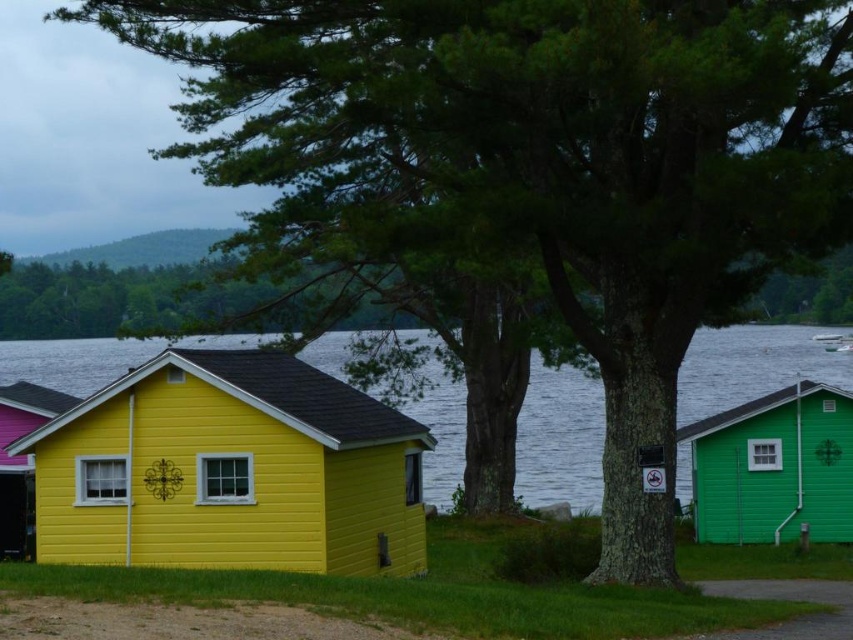
Does transparent water at lower center appear on the left side of yellow wood cabin at lower left?

In fact, transparent water at lower center is to the right of yellow wood cabin at lower left.

Is transparent water at lower center to the right of yellow wood cabin at lower left from the viewer's perspective?

Yes, transparent water at lower center is to the right of yellow wood cabin at lower left.

The image size is (853, 640). I want to click on transparent water at lower center, so click(x=560, y=438).

Between point (848, 419) and point (30, 461), which one is positioned in front?

Positioned in front is point (30, 461).

Can you confirm if green matte wood cabin at right is shorter than yellow wood cabin at lower left?

Incorrect, green matte wood cabin at right's height does not fall short of yellow wood cabin at lower left's.

Which is behind, point (780, 481) or point (62, 410)?

The point (780, 481) is behind.

Locate an element on the screen. green matte wood cabin at right is located at coordinates pos(775,467).

Is yellow wood cabin at center wider than yellow wood cabin at lower left?

Correct, the width of yellow wood cabin at center exceeds that of yellow wood cabin at lower left.

Is point (421, 440) more distant than point (3, 416)?

No, (421, 440) is closer to viewer.

Where is `yellow wood cabin at center`? The width and height of the screenshot is (853, 640). yellow wood cabin at center is located at coordinates [230, 470].